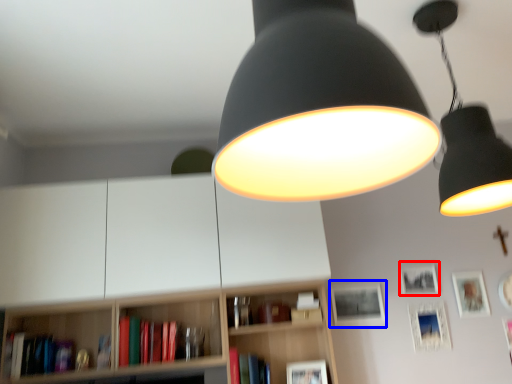
Question: Which of the following is the farthest to the observer, picture frame (highlighted by a red box) or picture frame (highlighted by a blue box)?

Choices:
 (A) picture frame
 (B) picture frame

Answer: (A)